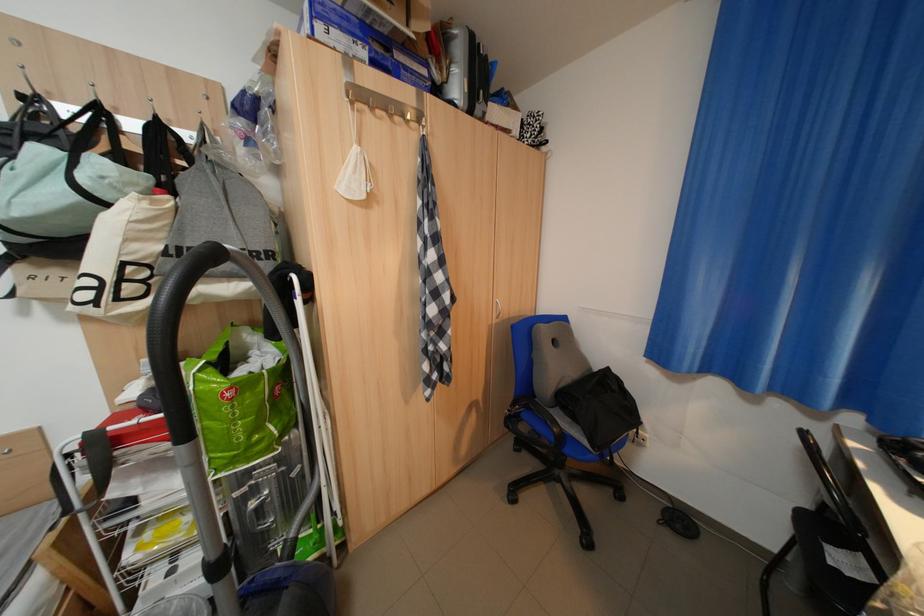
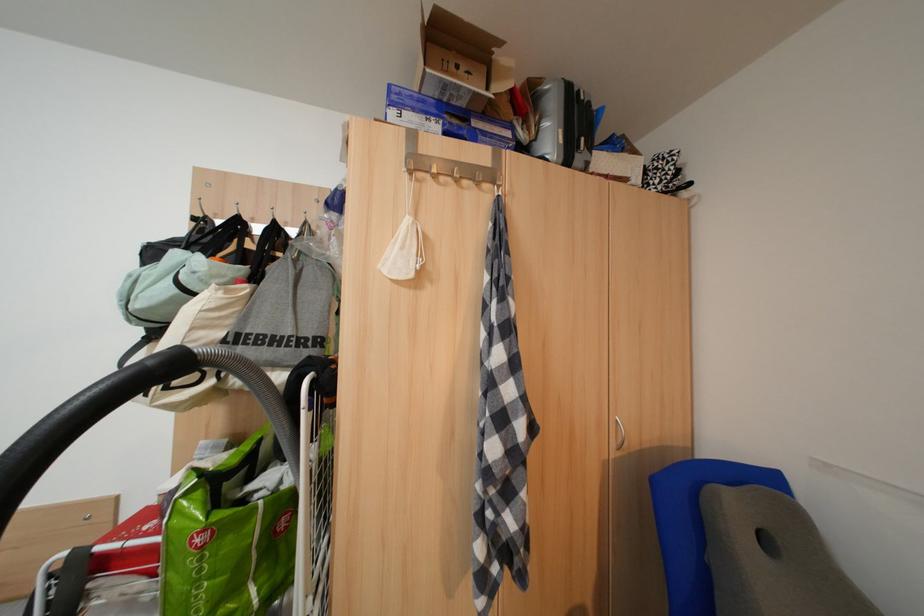
Find the pixel in the second image that matches point (261, 439) in the first image.

(225, 610)